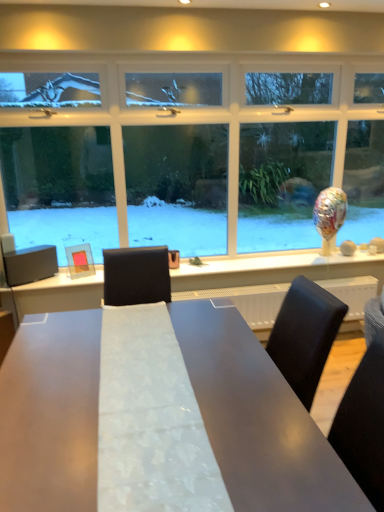
Locate an element on the screen. This screenshot has width=384, height=512. glossy white table at center is located at coordinates (257, 419).

The width and height of the screenshot is (384, 512). Describe the element at coordinates (257, 419) in the screenshot. I see `glossy white table at center` at that location.

Where is `glossy white table at center`? The width and height of the screenshot is (384, 512). glossy white table at center is located at coordinates (257, 419).